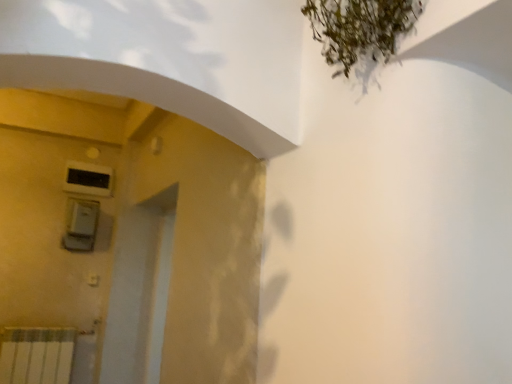
Question: In terms of size, does black plastic air conditioning unit at upper left appear bigger or smaller than satin silver switch at left?

Choices:
 (A) big
 (B) small

Answer: (B)

Question: Is point (100, 190) closer or farther from the camera than point (69, 233)?

Choices:
 (A) farther
 (B) closer

Answer: (A)

Question: Would you say black plastic air conditioning unit at upper left is to the left or to the right of satin silver switch at left in the picture?

Choices:
 (A) left
 (B) right

Answer: (A)

Question: From the image's perspective, is satin silver switch at left above or below black plastic air conditioning unit at upper left?

Choices:
 (A) below
 (B) above

Answer: (A)

Question: Looking at their shapes, would you say satin silver switch at left is wider or thinner than black plastic air conditioning unit at upper left?

Choices:
 (A) thin
 (B) wide

Answer: (B)

Question: Is point (94, 235) positioned closer to the camera than point (106, 187)?

Choices:
 (A) farther
 (B) closer

Answer: (B)

Question: Visually, is satin silver switch at left positioned to the left or to the right of black plastic air conditioning unit at upper left?

Choices:
 (A) left
 (B) right

Answer: (B)